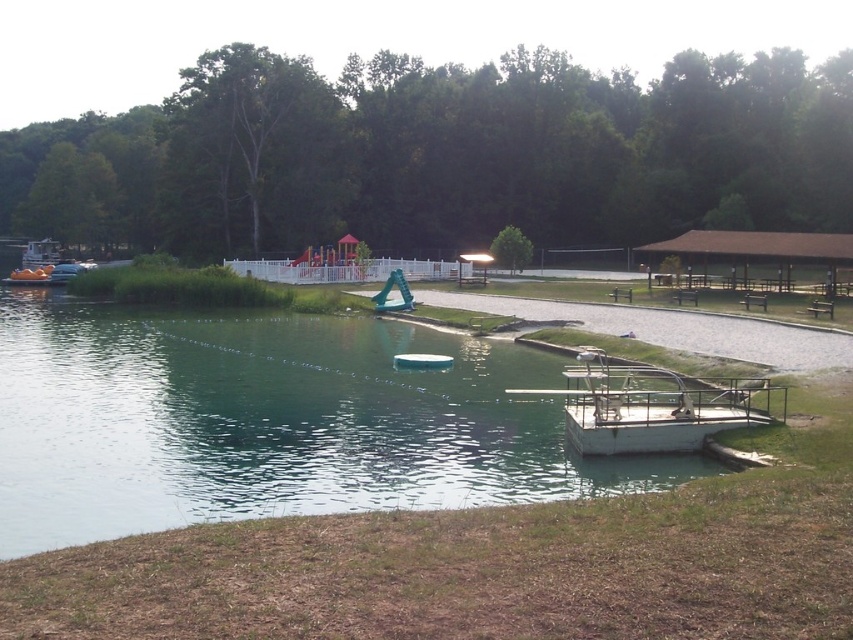
Question: Which point is farther to the camera?

Choices:
 (A) white plastic boat at center
 (B) green metallic dock at lower right

Answer: (A)

Question: Does green metallic dock at lower right appear over white plastic boat at center?

Choices:
 (A) yes
 (B) no

Answer: (A)

Question: Can you confirm if green metallic dock at lower right is positioned to the left of white plastic boat at center?

Choices:
 (A) yes
 (B) no

Answer: (A)

Question: Does green metallic dock at lower right appear on the left side of white plastic boat at center?

Choices:
 (A) no
 (B) yes

Answer: (B)

Question: Which object appears closest to the camera in this image?

Choices:
 (A) green metallic dock at lower right
 (B) white plastic boat at center

Answer: (A)